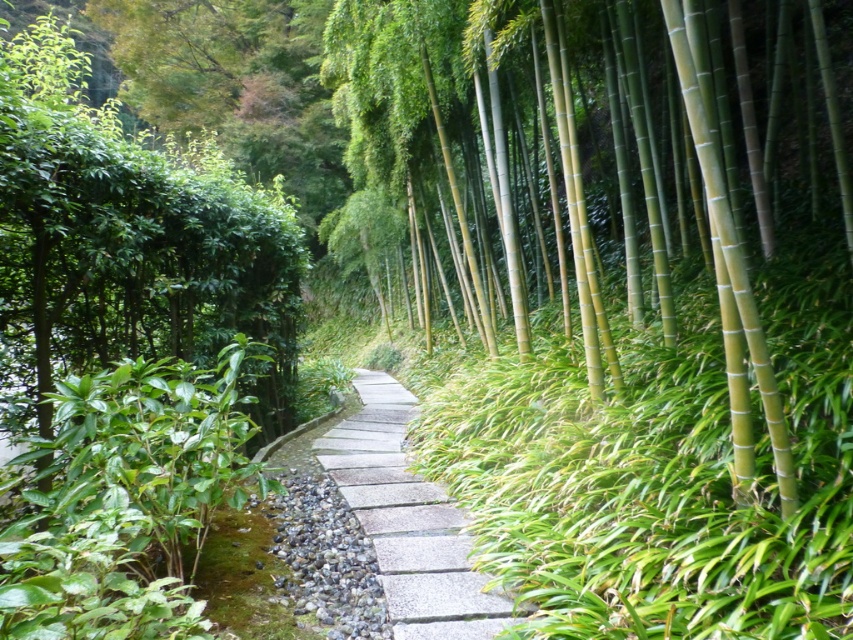
You are standing at the center of the stone pathway. You want to locate the green smooth bamboo at right. Which direction should you look?

The green smooth bamboo at right is located to your right side, so you should look to your right to locate it.

You are a gardener planning to install a fence along the gray stone path at center. The fence needs to be placed 4 meters away from the green smooth bamboo at right to comply with local regulations. Based on the scene description, will the fence placement meet the regulation requirements?

The distance between the green smooth bamboo at right and the gray stone path at center is 4.22 meters. Since the required distance is 4 meters, the fence placement will meet the regulation requirements as it exceeds the minimum distance requirement.

Based on the photo, you are a gardener planning to trim the green smooth bamboo at right and the gray stone path at center needs maintenance. Based on their positions, which object is closer to you as you stand at the entrance of the pathway?

The green smooth bamboo at right is closer to you because it is in front of the gray stone path at center, meaning it is positioned nearer to your current location at the entrance.